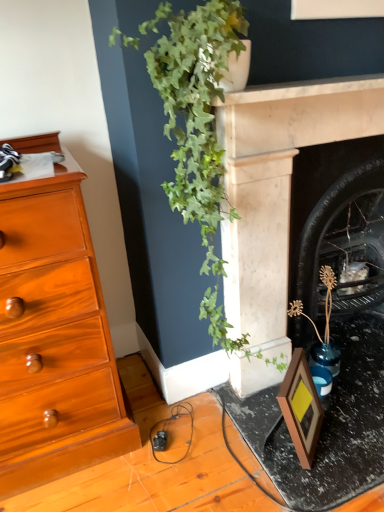
This screenshot has width=384, height=512. What are the coordinates of `vacant space behind wooden picture frame at lower right` in the screenshot? It's located at (259, 400).